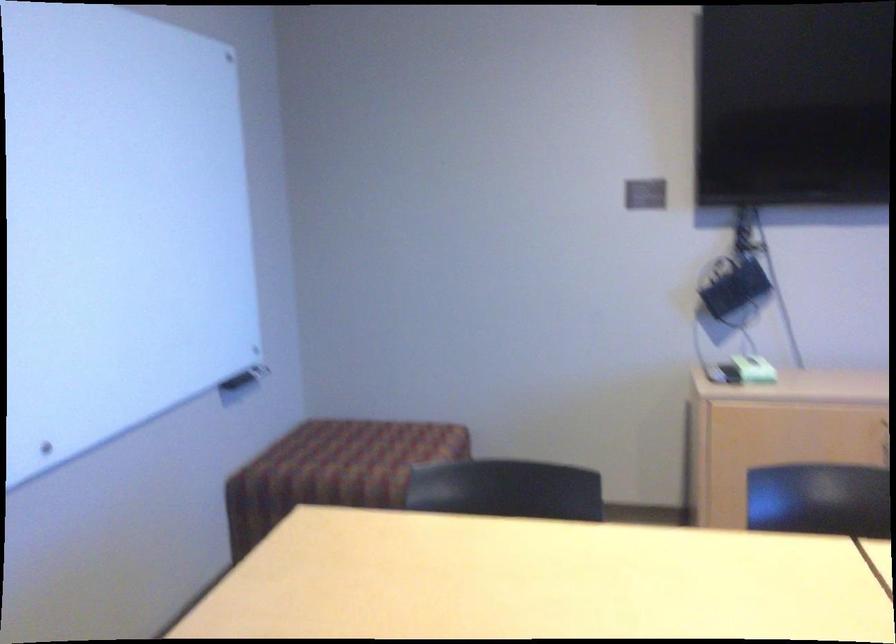
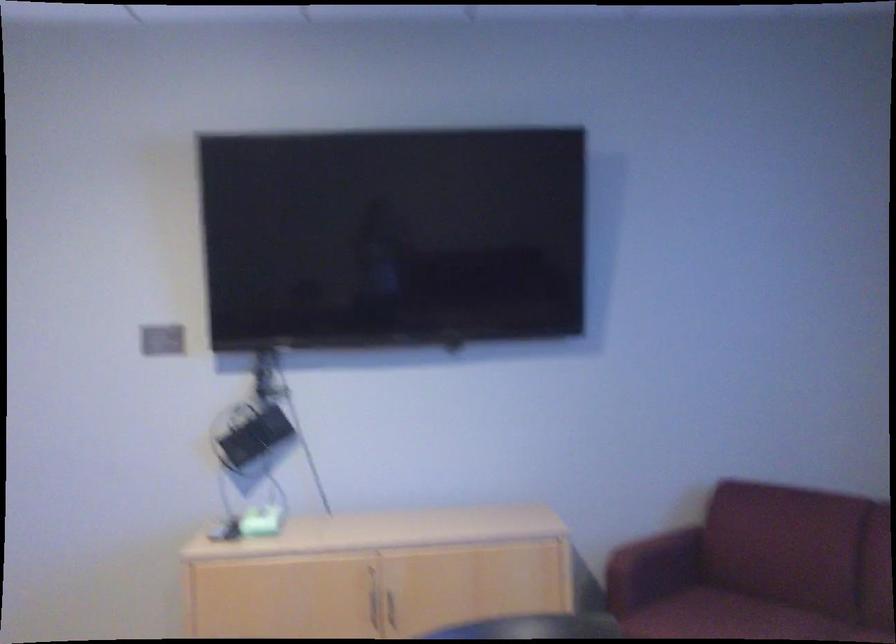
Question: What movement of the cameraman would produce the second image?

Choices:
 (A) Left
 (B) Right
 (C) Forward
 (D) Backward

Answer: (B)